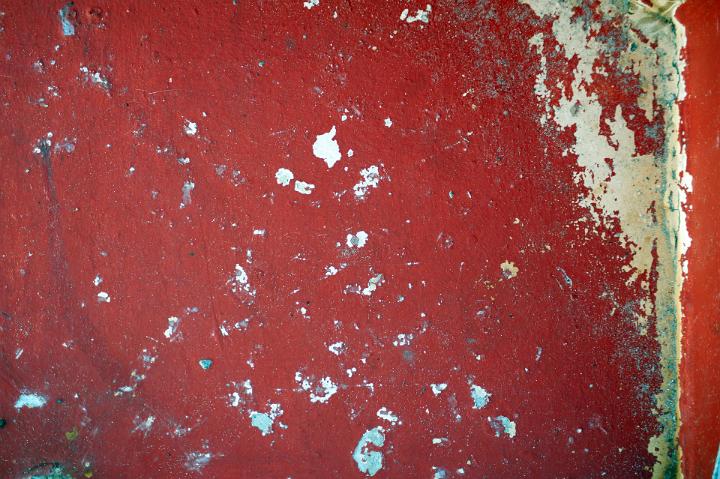
Find the location of `dark red paint`. dark red paint is located at coordinates (444, 244).